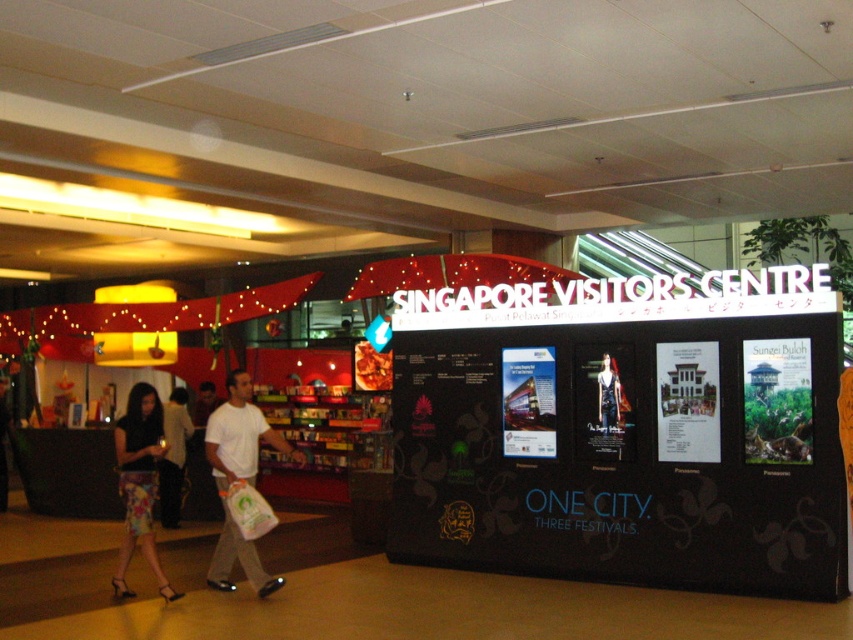
Does white matte t-shirt at center appear on the right side of floral skirt at lower left?

Correct, you'll find white matte t-shirt at center to the right of floral skirt at lower left.

Which is above, white matte t-shirt at center or floral skirt at lower left?

white matte t-shirt at center is higher up.

Between point (254, 444) and point (152, 436), which one is positioned behind?

The point (254, 444) is behind.

Locate an element on the screen. The width and height of the screenshot is (853, 640). white matte t-shirt at center is located at coordinates (239, 477).